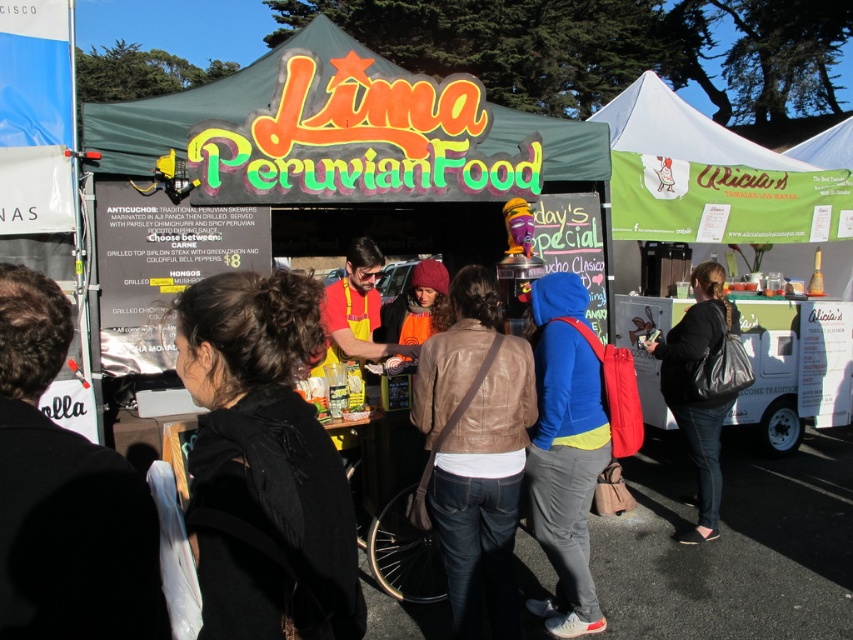
Question: Does black leather jacket at lower left have a greater width compared to black leather jacket at center?

Choices:
 (A) yes
 (B) no

Answer: (B)

Question: Which of these objects is positioned farthest from the white cardboard food truck at right?

Choices:
 (A) black leather jacket at center
 (B) green canvas tent at center
 (C) blue fleece jacket at center

Answer: (B)

Question: Is brown leather jacket at center thinner than white cardboard food truck at right?

Choices:
 (A) no
 (B) yes

Answer: (B)

Question: Which point appears farthest from the camera in this image?

Choices:
 (A) (125, 506)
 (B) (573, 294)
 (C) (320, 36)
 (D) (622, 333)

Answer: (D)

Question: Can you confirm if black fabric at center is positioned to the left of black leather jacket at lower left?

Choices:
 (A) yes
 (B) no

Answer: (B)

Question: Which point is closer to the camera taking this photo?

Choices:
 (A) (247, 637)
 (B) (73, 576)

Answer: (B)